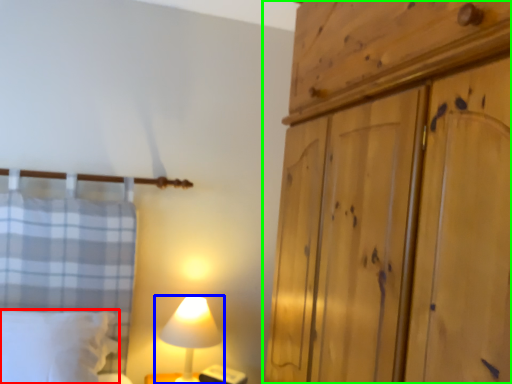
Question: Considering the real-world distances, which object is closest to pillow (highlighted by a red box)? lamp (highlighted by a blue box) or cupboard (highlighted by a green box).

Choices:
 (A) lamp
 (B) cupboard

Answer: (A)